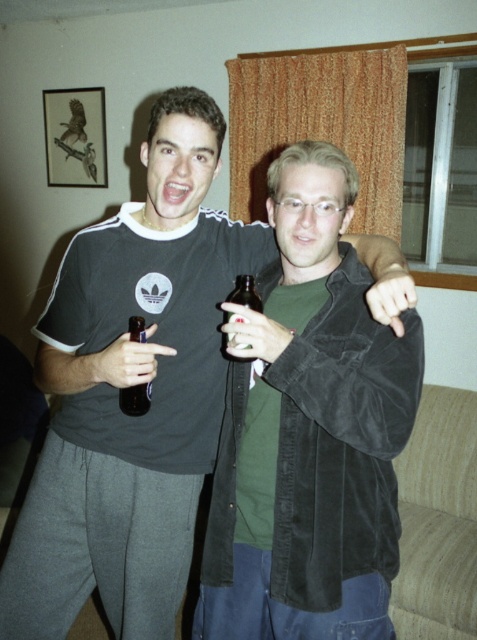
Question: Which object appears closest to the camera in this image?

Choices:
 (A) brown glass bottle at center
 (B) velvet black jacket at center

Answer: (B)

Question: Estimate the real-world distances between objects in this image. Which object is farther from the matte plastic bottle at center?

Choices:
 (A) velvet black jacket at center
 (B) brown glass bottle at center

Answer: (A)

Question: Which of these objects is positioned closest to the velvet black jacket at center?

Choices:
 (A) matte plastic bottle at center
 (B) brown glass bottle at center

Answer: (B)

Question: Is velvet black jacket at center further to camera compared to matte plastic bottle at center?

Choices:
 (A) yes
 (B) no

Answer: (B)

Question: Can you confirm if velvet black jacket at center is smaller than brown glass bottle at center?

Choices:
 (A) no
 (B) yes

Answer: (A)

Question: Is matte plastic bottle at center to the left of brown glass bottle at center from the viewer's perspective?

Choices:
 (A) no
 (B) yes

Answer: (B)